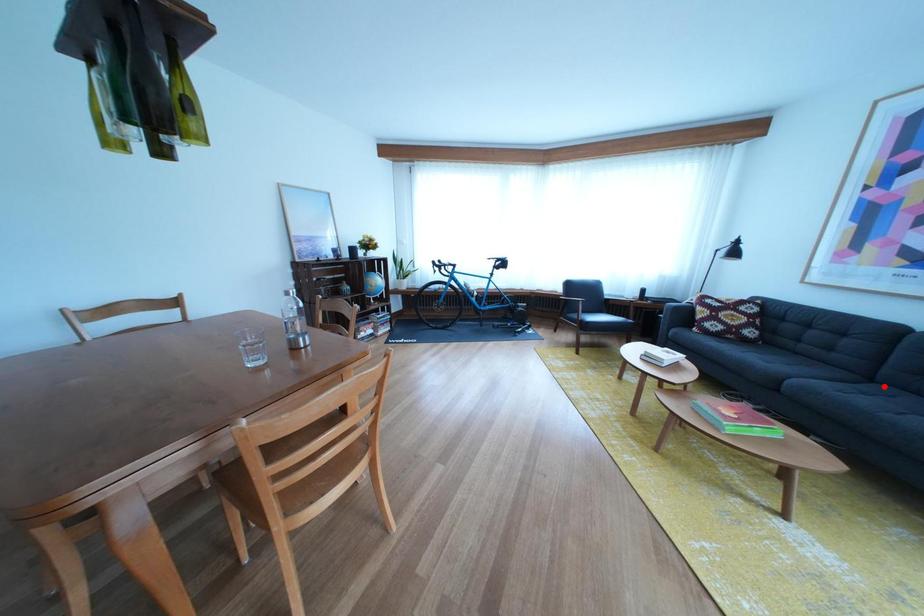
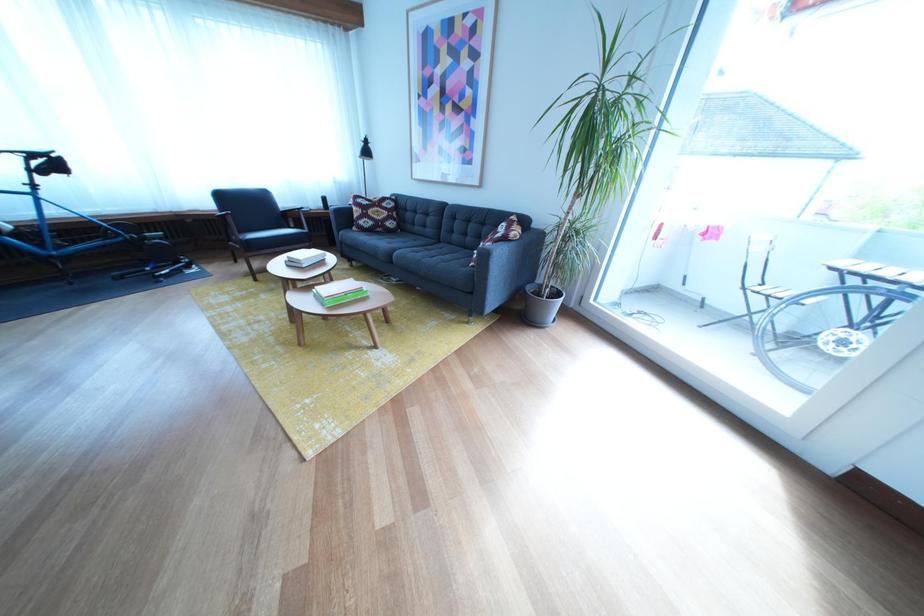
In the second image, find the point that corresponds to the highlighted location in the first image.

(453, 248)